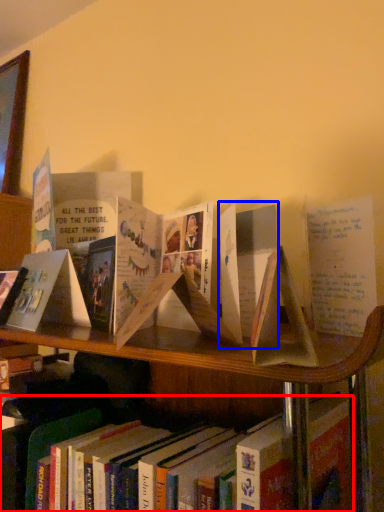
Question: Which of the following is the closest to the observer, book (highlighted by a red box) or paperback book (highlighted by a blue box)?

Choices:
 (A) book
 (B) paperback book

Answer: (B)